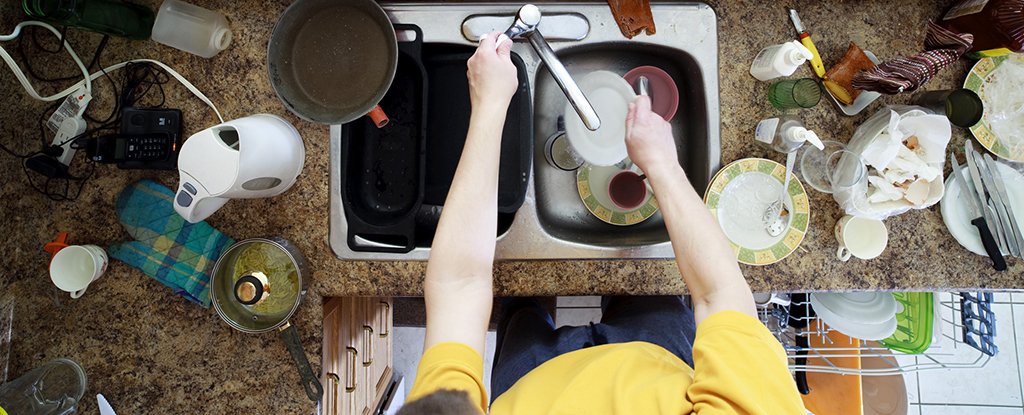
Locate an element on the screen. Image resolution: width=1024 pixels, height=415 pixels. floor is located at coordinates (404, 340).